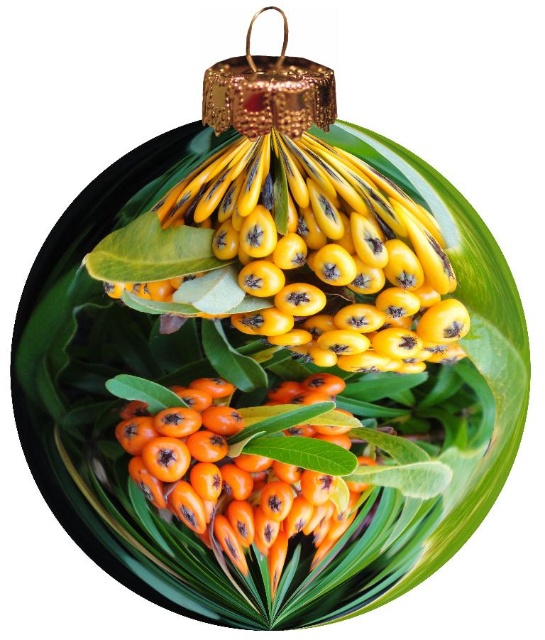
You are an interior designer planning to place a new decorative item on the spherical ornament. The existing shiny yellow berries at center are at coordinates point 0.402, 0.578. If you want to place the new item directly above the berries, where should you position it?

To place the new item directly above the shiny yellow berries at center, you should position it at a higher y coordinate than 0.578 while keeping the x coordinate around 0.402.

You are an interior designer planning to place a new decorative item on a shelf. You have a spherical ornament with a golden hanger and shiny yellow berries at its center. The ornament is placed at coordinates point (314, 257). If you want to place a small candleholder to the right of the berries, where should you position it?

The shiny yellow berries at center are located at point (314, 257). To place the candleholder to the right of them, position it at a coordinate with an x value greater than 0.402, keeping the y value similar to maintain alignment.